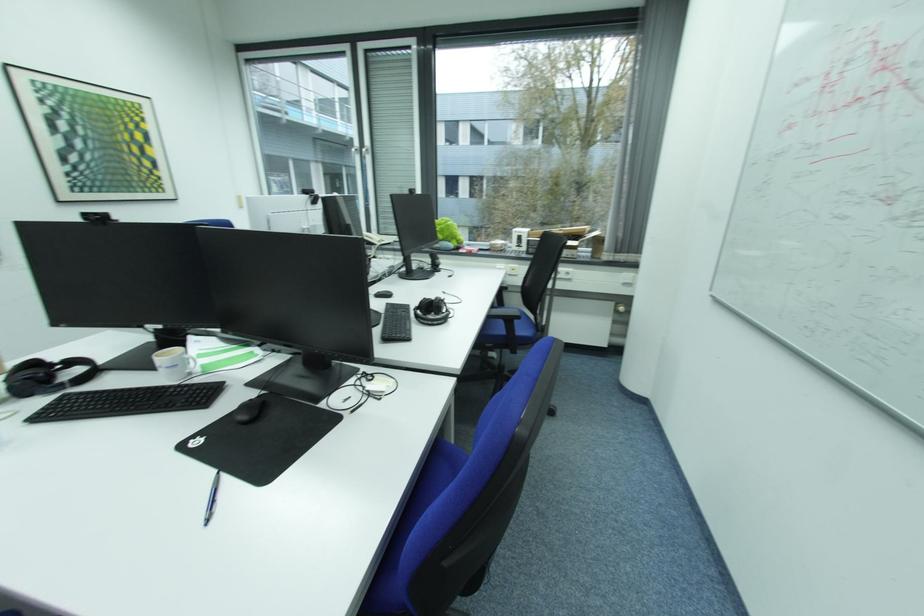
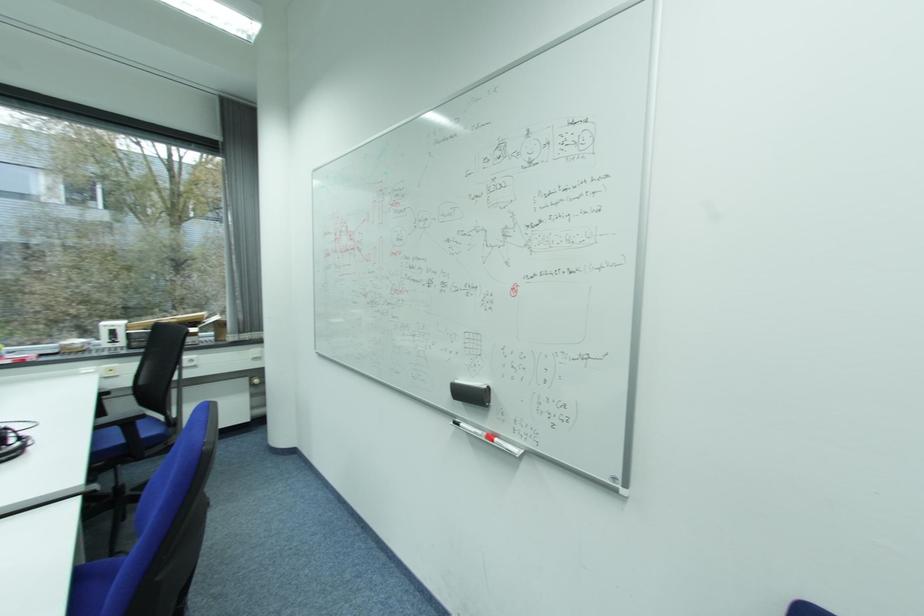
In the second image, find the point that corresponds to point (512, 367) in the first image.

(131, 487)